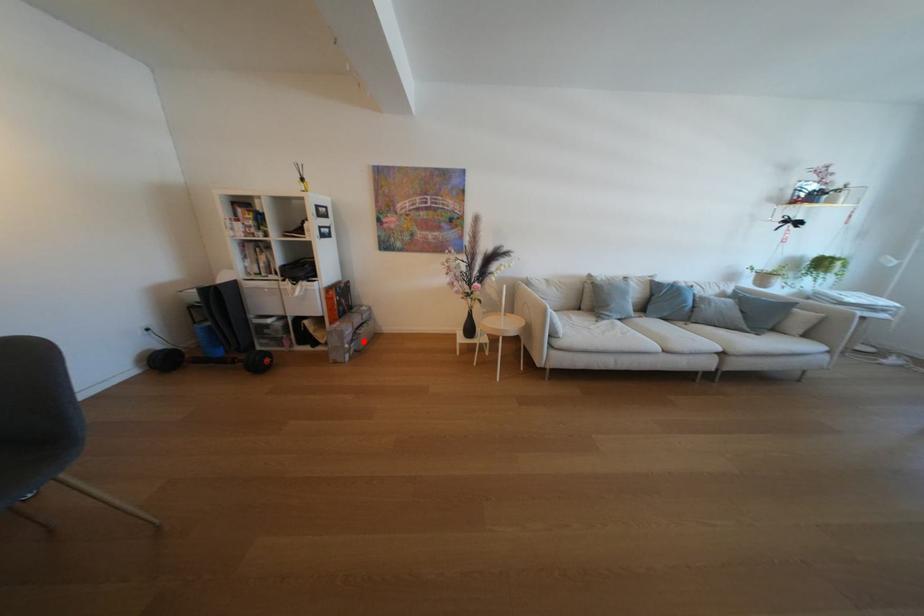
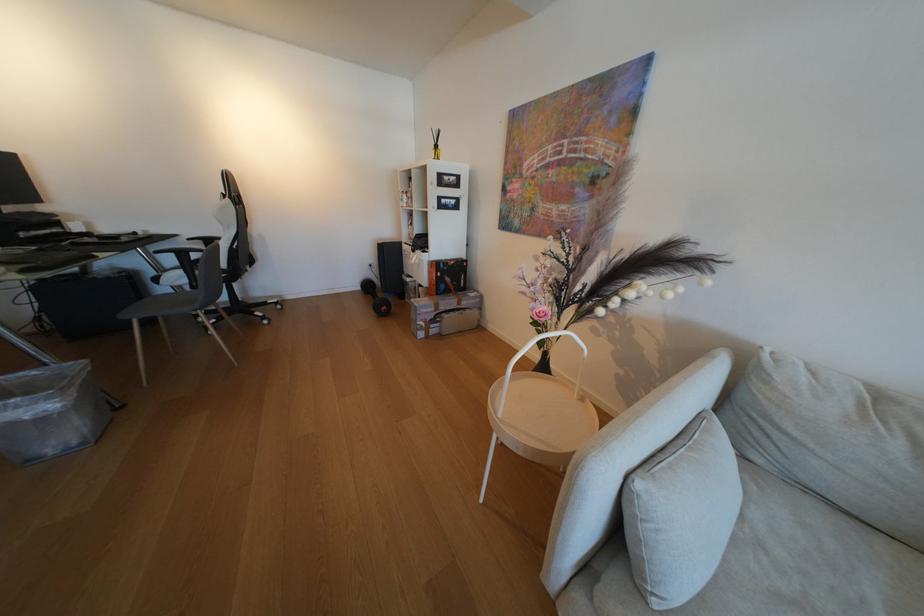
In the second image, find the point that corresponds to the highlighted location in the first image.

(444, 322)